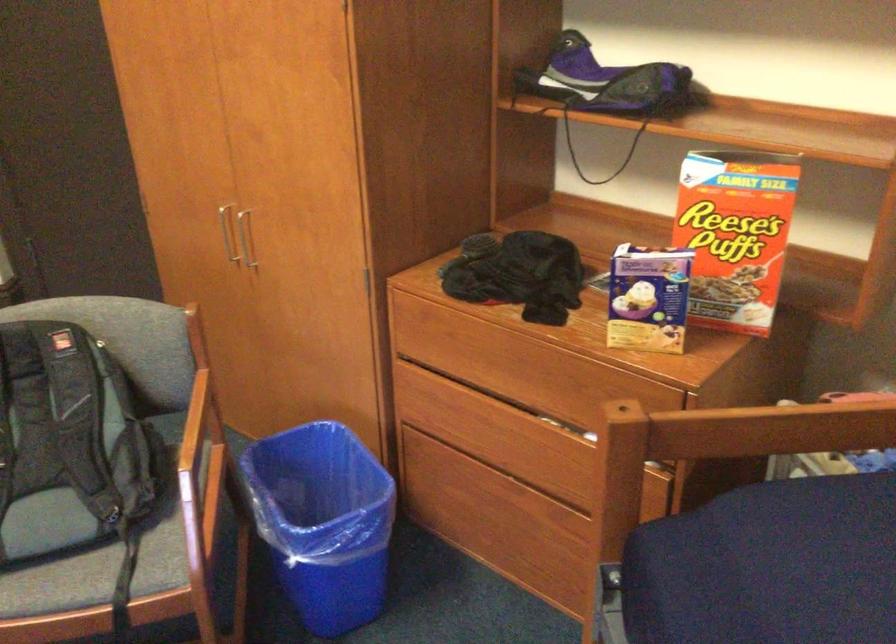
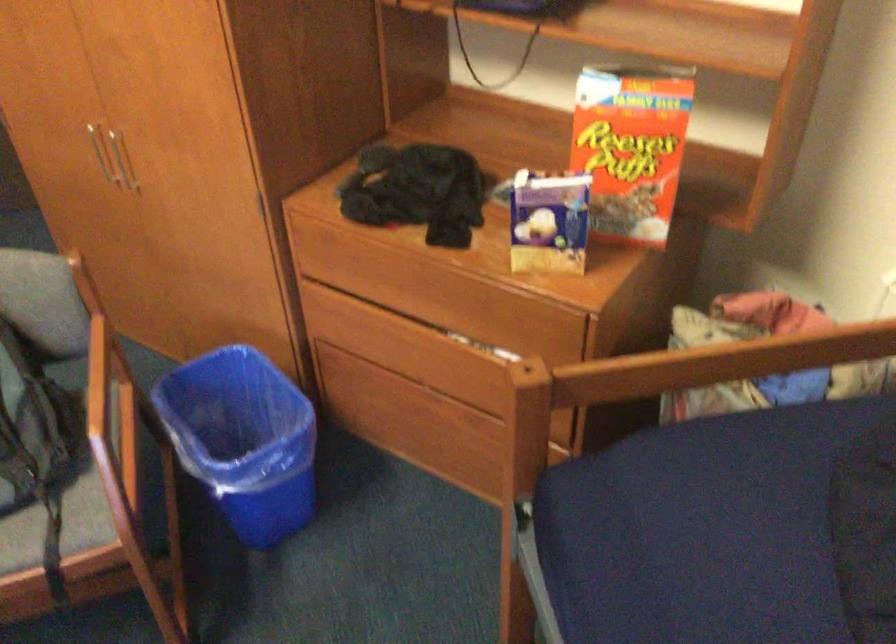
Question: The first image is from the beginning of the video and the second image is from the end. How did the camera likely rotate when shooting the video?

Choices:
 (A) Left
 (B) Right
 (C) Up
 (D) Down

Answer: (D)